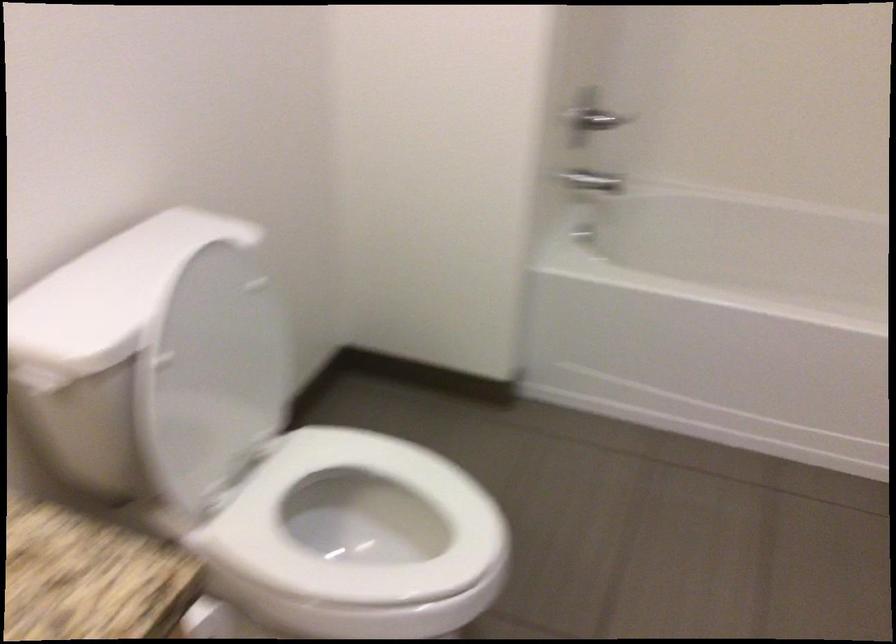
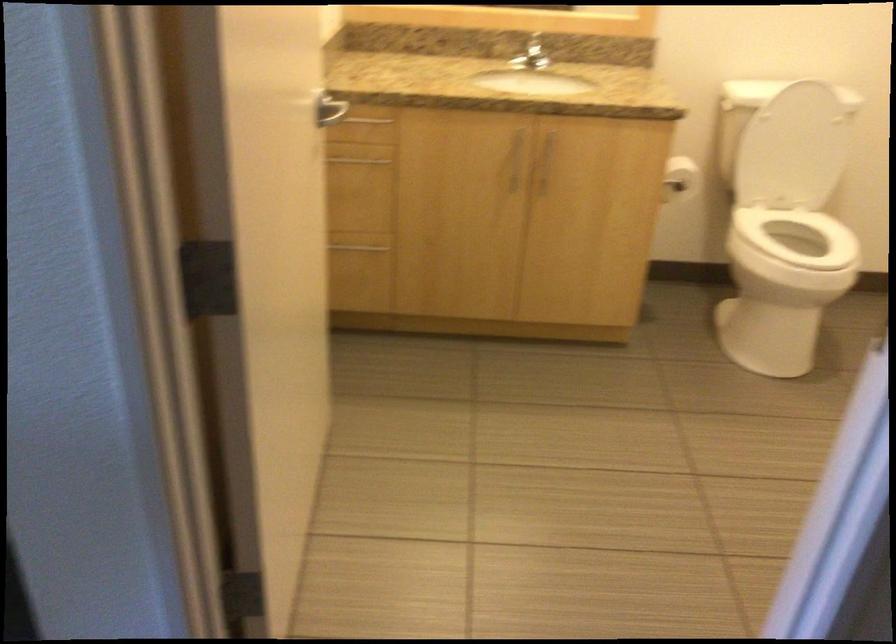
Locate, in the second image, the point that corresponds to pixel 220 365 in the first image.

(793, 149)